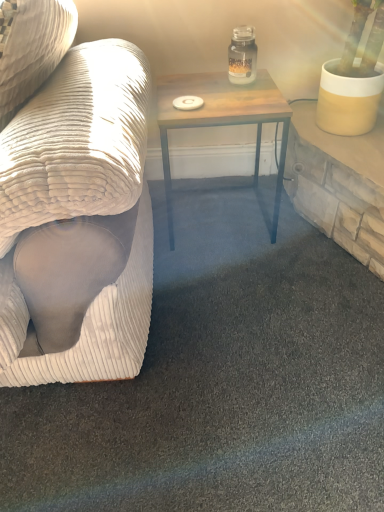
Question: Is clear glass jar at upper center not close to white corduroy couch at left?

Choices:
 (A) no
 (B) yes

Answer: (A)

Question: Considering the relative sizes of clear glass jar at upper center and white corduroy couch at left in the image provided, is clear glass jar at upper center wider than white corduroy couch at left?

Choices:
 (A) yes
 (B) no

Answer: (B)

Question: Is clear glass jar at upper center to the right of white corduroy couch at left from the viewer's perspective?

Choices:
 (A) yes
 (B) no

Answer: (A)

Question: Can you confirm if clear glass jar at upper center is smaller than white corduroy couch at left?

Choices:
 (A) no
 (B) yes

Answer: (B)

Question: Is clear glass jar at upper center aimed at white corduroy couch at left?

Choices:
 (A) no
 (B) yes

Answer: (A)

Question: From the image's perspective, is wooden table at center above or below clear glass jar at upper center?

Choices:
 (A) below
 (B) above

Answer: (A)

Question: Is point [173, 80] closer or farther from the camera than point [236, 55]?

Choices:
 (A) closer
 (B) farther

Answer: (B)

Question: From their relative heights in the image, would you say wooden table at center is taller or shorter than clear glass jar at upper center?

Choices:
 (A) short
 (B) tall

Answer: (B)

Question: Considering the positions of wooden table at center and clear glass jar at upper center in the image, is wooden table at center wider or thinner than clear glass jar at upper center?

Choices:
 (A) wide
 (B) thin

Answer: (A)

Question: Considering the positions of wooden table at center and white corduroy couch at left in the image, is wooden table at center wider or thinner than white corduroy couch at left?

Choices:
 (A) wide
 (B) thin

Answer: (B)

Question: Is wooden table at center taller or shorter than white corduroy couch at left?

Choices:
 (A) tall
 (B) short

Answer: (B)

Question: From a real-world perspective, is wooden table at center positioned above or below white corduroy couch at left?

Choices:
 (A) above
 (B) below

Answer: (B)

Question: Does point (241, 114) appear closer or farther from the camera than point (127, 76)?

Choices:
 (A) farther
 (B) closer

Answer: (A)

Question: From a real-world perspective, relative to wooden table at center, is white corduroy couch at left vertically above or below?

Choices:
 (A) above
 (B) below

Answer: (A)

Question: Considering the positions of white corduroy couch at left and wooden table at center in the image, is white corduroy couch at left taller or shorter than wooden table at center?

Choices:
 (A) tall
 (B) short

Answer: (A)